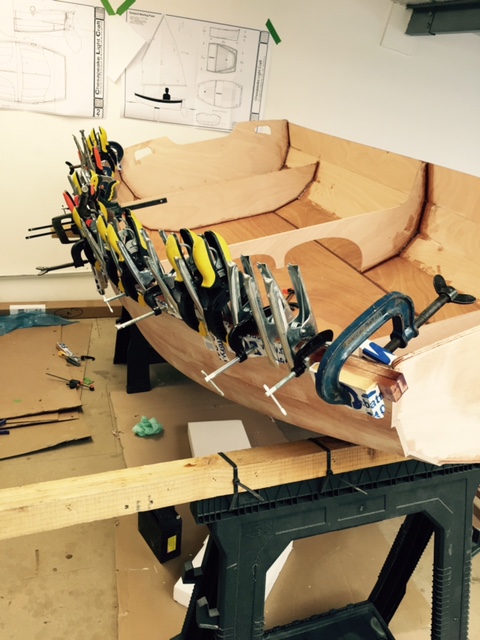
Locate an element on the screen. This screenshot has width=480, height=640. cardboard on floor is located at coordinates (26, 367), (100, 333), (124, 406), (81, 433), (57, 557), (152, 588), (323, 576).